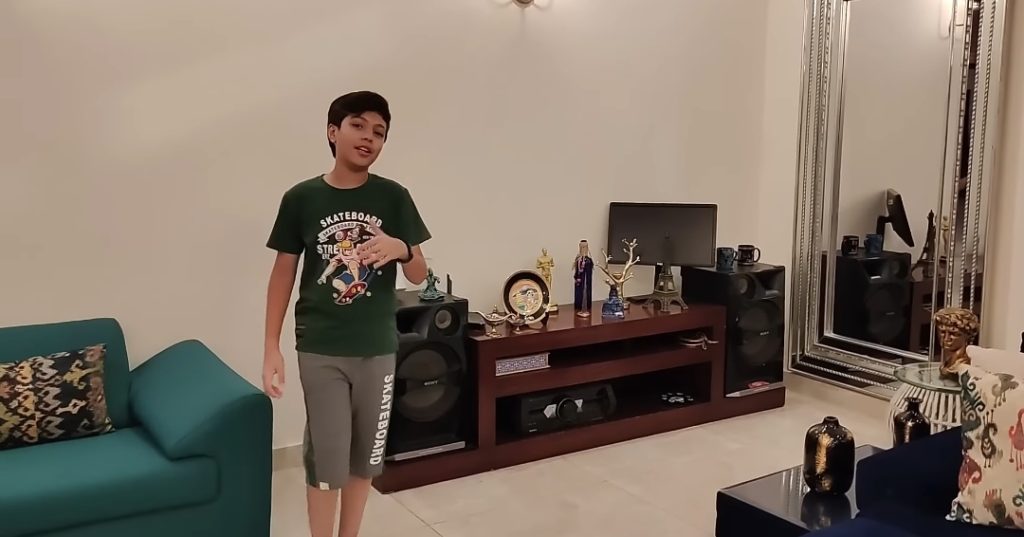
This screenshot has height=537, width=1024. In order to click on plate in this screenshot , I will do `click(518, 301)`.